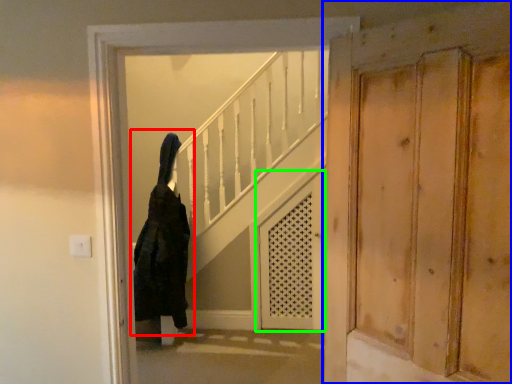
Question: Based on their relative distances, which object is nearer to woman (highlighted by a red box)? Choose from door (highlighted by a blue box) and screen door (highlighted by a green box).

Choices:
 (A) door
 (B) screen door

Answer: (B)